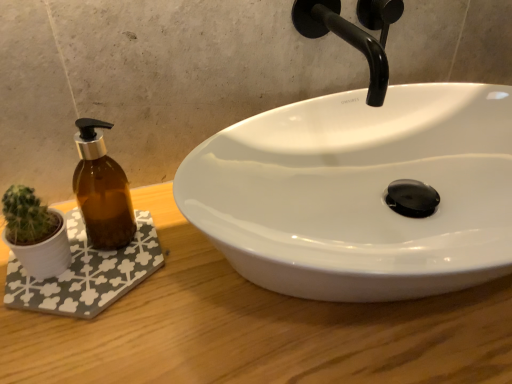
Question: Is wooden counter at center wider or thinner than white fabric bath mat at lower left?

Choices:
 (A) wide
 (B) thin

Answer: (A)

Question: Would you say wooden counter at center is to the left or to the right of white fabric bath mat at lower left in the picture?

Choices:
 (A) left
 (B) right

Answer: (B)

Question: Considering the real-world distances, which object is farthest from the black matte faucet at upper center?

Choices:
 (A) white glossy sink at center
 (B) white fabric bath mat at lower left
 (C) wooden counter at center

Answer: (B)

Question: Estimate the real-world distances between objects in this image. Which object is farther from the white fabric bath mat at lower left?

Choices:
 (A) black matte faucet at upper center
 (B) wooden counter at center
 (C) white glossy sink at center

Answer: (A)